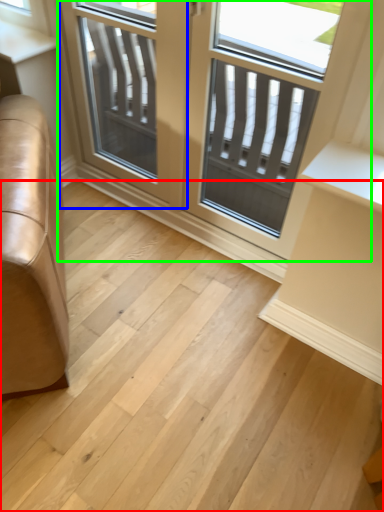
Question: Which object is positioned farthest from stairwell (highlighted by a red box)? Select from screen door (highlighted by a blue box) and window (highlighted by a green box).

Choices:
 (A) screen door
 (B) window

Answer: (A)